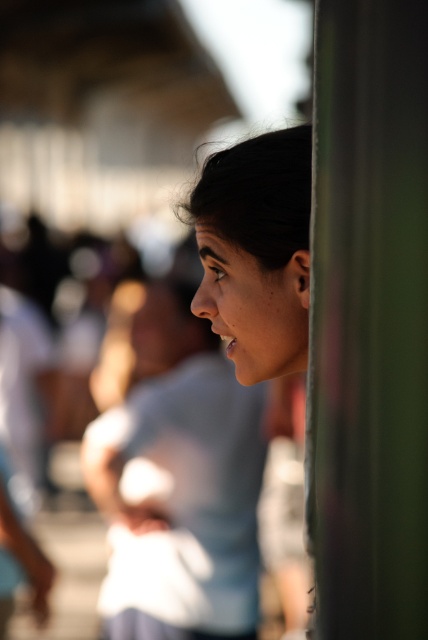
Question: Is green metallic pole at right to the right of smooth skin face at center from the viewer's perspective?

Choices:
 (A) yes
 (B) no

Answer: (A)

Question: Does green metallic pole at right appear on the right side of smooth skin face at center?

Choices:
 (A) yes
 (B) no

Answer: (A)

Question: Which point is closer to the camera taking this photo?

Choices:
 (A) (353, 499)
 (B) (282, 362)

Answer: (A)

Question: Can you confirm if green metallic pole at right is thinner than smooth skin face at center?

Choices:
 (A) no
 (B) yes

Answer: (B)

Question: Which point is farther from the camera taking this photo?

Choices:
 (A) (281, 131)
 (B) (329, 616)

Answer: (A)